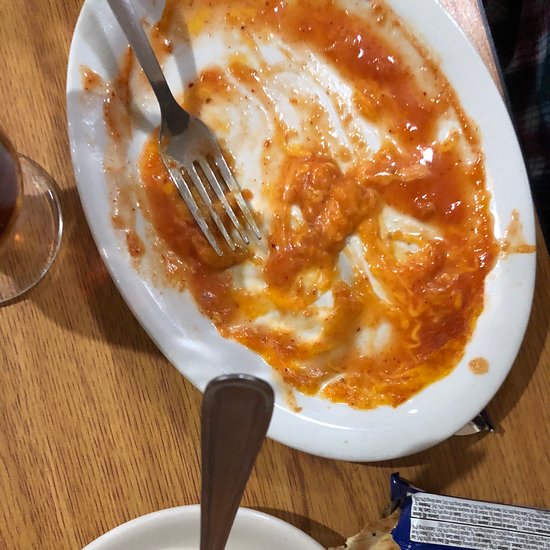
You are a GUI agent. You are given a task and a screenshot of the screen. Output one action in this format:
    pyautogui.click(x=<x>, y=<y>)
    Task: Click on the dark space under table
    The width and height of the screenshot is (550, 550).
    Given the screenshot: What is the action you would take?
    pyautogui.click(x=516, y=29)